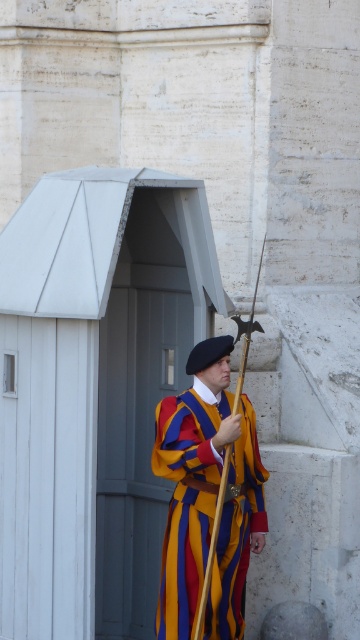
Based on the scene, which object is wider between the white painted wood hut at center and the multicolored fabric uniform at center?

The white painted wood hut at center is wider than the multicolored fabric uniform at center.